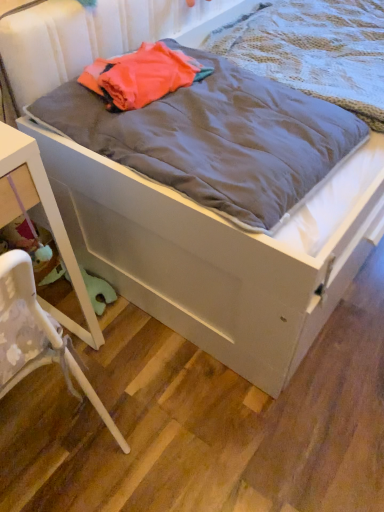
Question: Is white plastic chair at lower left looking in the opposite direction of gray soft blanket at center, positioned as the 2th blanket in front-to-back order?

Choices:
 (A) no
 (B) yes

Answer: (A)

Question: Are white plastic chair at lower left and gray soft blanket at center, positioned as the 2th blanket in front-to-back order, far apart?

Choices:
 (A) no
 (B) yes

Answer: (B)

Question: Considering the relative sizes of white plastic chair at lower left and gray soft blanket at center, positioned as the 2th blanket in front-to-back order, in the image provided, is white plastic chair at lower left taller than gray soft blanket at center, positioned as the 2th blanket in front-to-back order,?

Choices:
 (A) yes
 (B) no

Answer: (A)

Question: Is white plastic chair at lower left at the right side of gray soft blanket at center, positioned as the first blanket in back-to-front order?

Choices:
 (A) no
 (B) yes

Answer: (A)

Question: Does white plastic chair at lower left come behind gray soft blanket at center, positioned as the 2th blanket in front-to-back order?

Choices:
 (A) yes
 (B) no

Answer: (B)

Question: From a real-world perspective, is white plastic chair at lower left beneath gray soft blanket at center, positioned as the first blanket in back-to-front order?

Choices:
 (A) no
 (B) yes

Answer: (B)

Question: Is white plastic chair at lower left in contact with gray cotton blanket at center, acting as the first blanket starting from the front?

Choices:
 (A) no
 (B) yes

Answer: (A)

Question: From a real-world perspective, is white plastic chair at lower left physically above gray cotton blanket at center, acting as the first blanket starting from the front?

Choices:
 (A) no
 (B) yes

Answer: (A)

Question: Is white plastic chair at lower left taller than gray cotton blanket at center, placed as the 2th blanket when sorted from back to front?

Choices:
 (A) yes
 (B) no

Answer: (A)

Question: Is white plastic chair at lower left positioned with its back to gray cotton blanket at center, acting as the first blanket starting from the front?

Choices:
 (A) no
 (B) yes

Answer: (A)

Question: Considering the relative positions of white plastic chair at lower left and gray cotton blanket at center, placed as the 2th blanket when sorted from back to front, in the image provided, is white plastic chair at lower left to the right of gray cotton blanket at center, placed as the 2th blanket when sorted from back to front, from the viewer's perspective?

Choices:
 (A) yes
 (B) no

Answer: (B)

Question: Is white plastic chair at lower left further to the viewer compared to gray cotton blanket at center, acting as the first blanket starting from the front?

Choices:
 (A) no
 (B) yes

Answer: (A)

Question: From a real-world perspective, is white glossy nightstand at lower left positioned over gray soft blanket at center, positioned as the 2th blanket in front-to-back order, based on gravity?

Choices:
 (A) no
 (B) yes

Answer: (A)